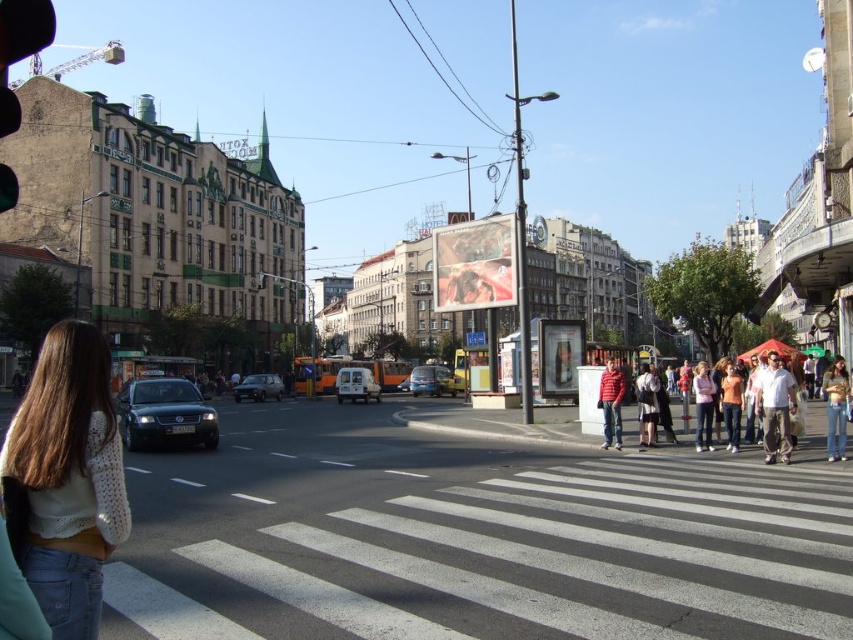
You are a pedestrian waiting at the crosswalk and see the red knit sweater at center and the pink fabric jacket at lower right. Which clothing item is closer to you?

The red knit sweater at center is closer to you because it is further to the viewer than the pink fabric jacket at lower right.

You are a fashion designer observing the urban scene. You notice the white cotton shirt at lower right and the light brown leather jacket at center. Which clothing item appears to be smaller in size?

The white cotton shirt at lower right is smaller than the light brown leather jacket at center.

You are a delivery person trying to navigate through the street. You see the white knitted sweater at lower left and the green glass traffic light at center. Which object takes up more space in the image?

The green glass traffic light at center takes up more space in the image than the white knitted sweater at lower left because the white knitted sweater at lower left occupies less space than green glass traffic light at center.